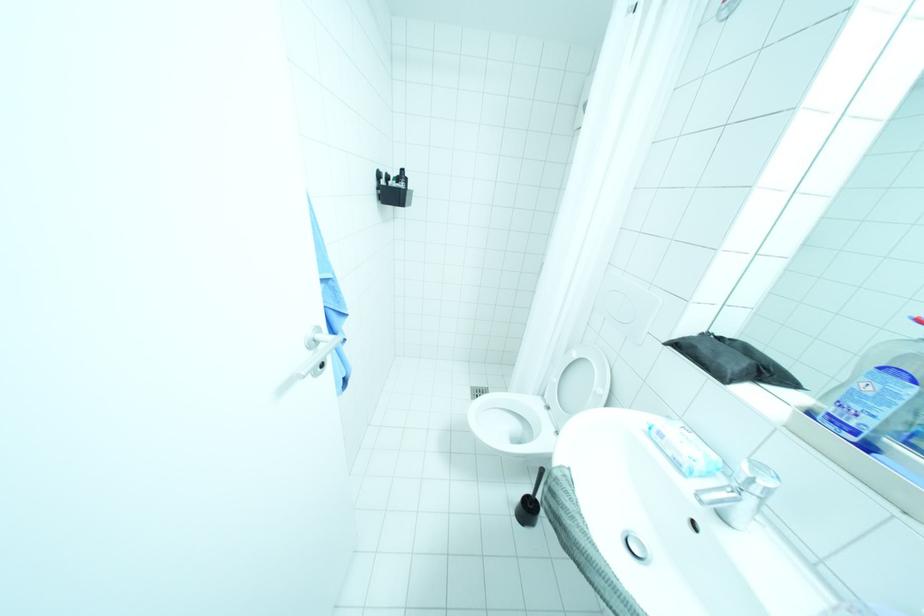
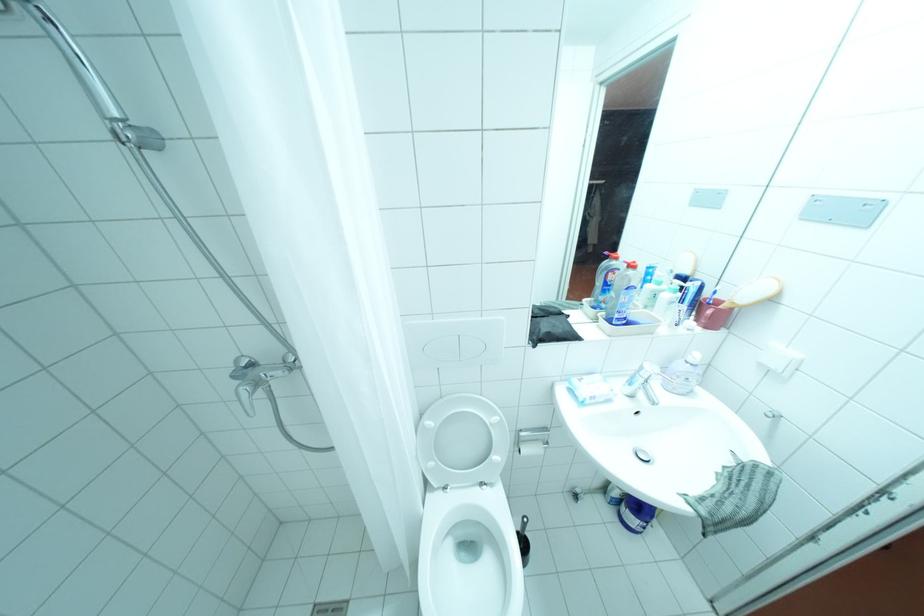
Where in the second image is the point corresponding to (556,407) from the first image?

(455, 487)